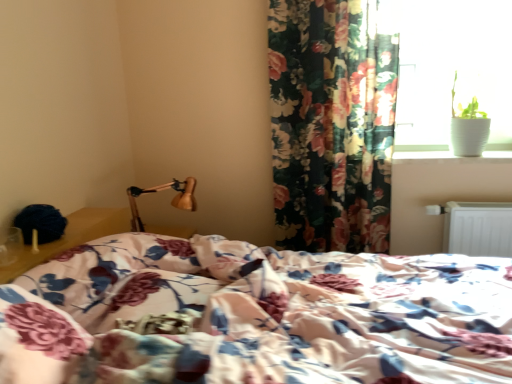
Question: Does white glossy window sill at upper right have a smaller size compared to wooden lamp at upper left?

Choices:
 (A) no
 (B) yes

Answer: (B)

Question: Does white glossy window sill at upper right appear on the right side of wooden lamp at upper left?

Choices:
 (A) yes
 (B) no

Answer: (A)

Question: Considering the relative sizes of white glossy window sill at upper right and wooden lamp at upper left in the image provided, is white glossy window sill at upper right taller than wooden lamp at upper left?

Choices:
 (A) no
 (B) yes

Answer: (A)

Question: Is white glossy window sill at upper right positioned with its back to wooden lamp at upper left?

Choices:
 (A) yes
 (B) no

Answer: (B)

Question: Does white glossy window sill at upper right come behind wooden lamp at upper left?

Choices:
 (A) no
 (B) yes

Answer: (B)

Question: Considering the relative sizes of white glossy window sill at upper right and wooden lamp at upper left in the image provided, is white glossy window sill at upper right shorter than wooden lamp at upper left?

Choices:
 (A) no
 (B) yes

Answer: (B)

Question: From the image's perspective, would you say wooden lamp at upper left is positioned over floral fabric bed at center?

Choices:
 (A) yes
 (B) no

Answer: (A)

Question: Can you confirm if wooden lamp at upper left is wider than floral fabric bed at center?

Choices:
 (A) yes
 (B) no

Answer: (B)

Question: Does wooden lamp at upper left have a lesser width compared to floral fabric bed at center?

Choices:
 (A) yes
 (B) no

Answer: (A)

Question: Does wooden lamp at upper left have a smaller size compared to floral fabric bed at center?

Choices:
 (A) no
 (B) yes

Answer: (B)

Question: Is wooden lamp at upper left not near floral fabric bed at center?

Choices:
 (A) no
 (B) yes

Answer: (A)

Question: Does wooden lamp at upper left appear on the left side of floral fabric bed at center?

Choices:
 (A) no
 (B) yes

Answer: (B)

Question: Is white metallic radiator at lower right outside white glossy window sill at upper right?

Choices:
 (A) yes
 (B) no

Answer: (A)